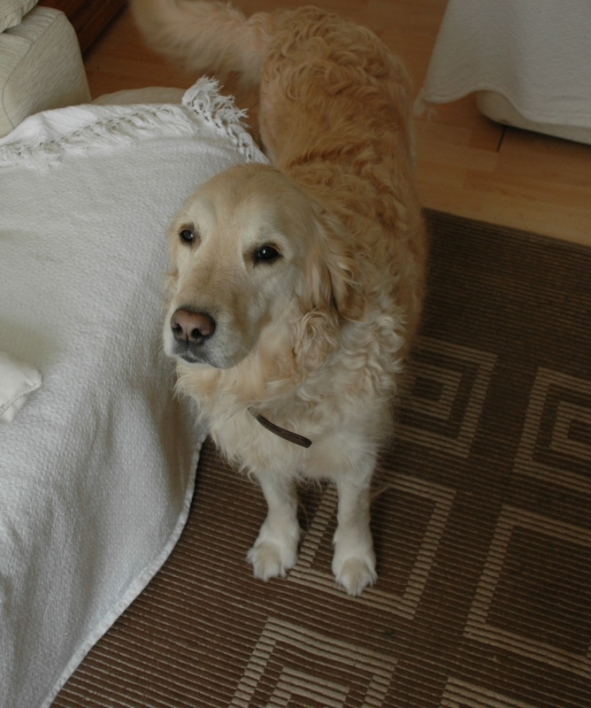
Where is `pillow`? The image size is (591, 708). pillow is located at coordinates (12, 384).